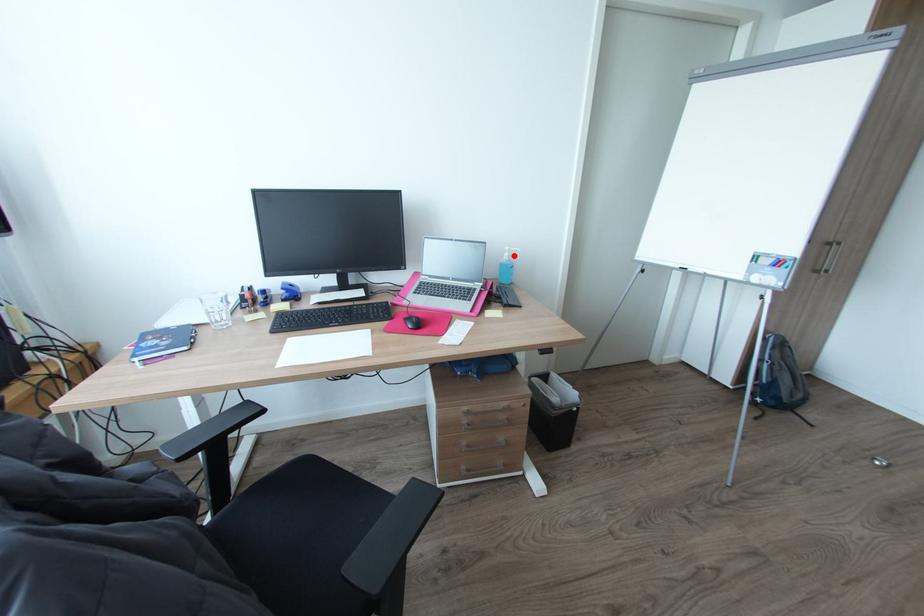
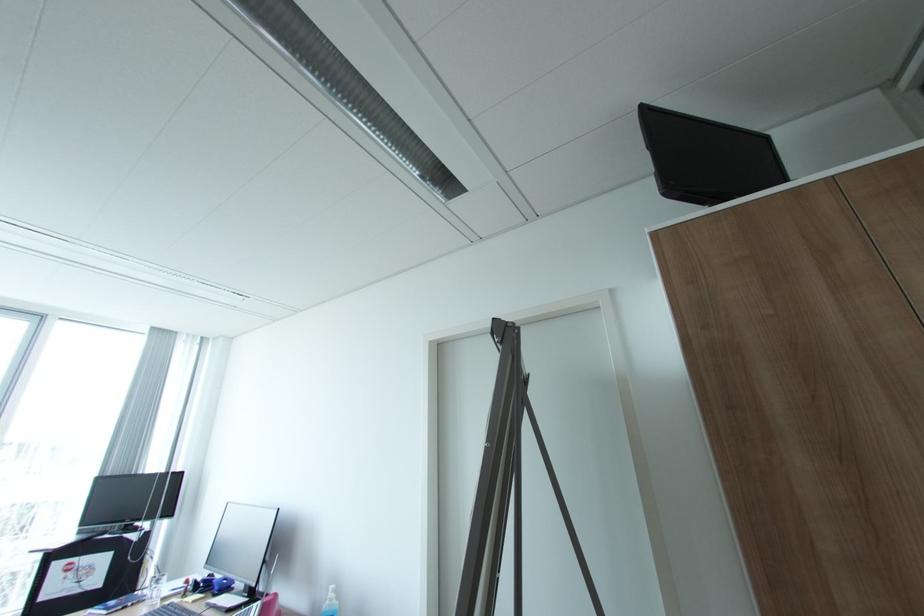
In the second image, find the point that corresponds to the highlighted location in the first image.

(336, 599)